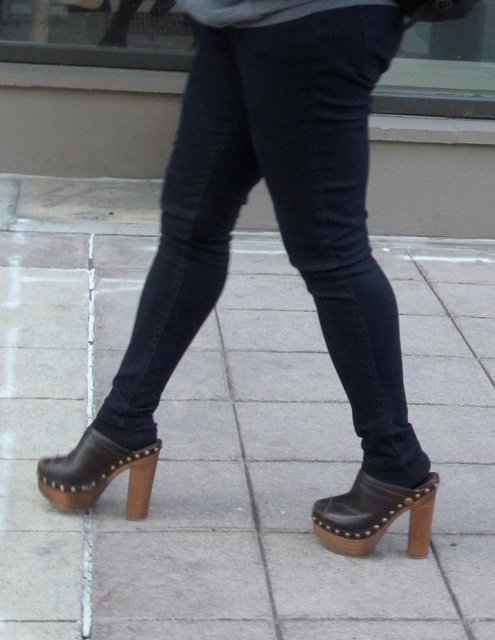
Is brown leather clogs at lower center taller than brown leather clog at lower right?

Indeed, brown leather clogs at lower center has a greater height compared to brown leather clog at lower right.

Does brown leather clogs at lower center appear on the right side of brown leather clog at lower right?

In fact, brown leather clogs at lower center is to the left of brown leather clog at lower right.

At what (x,y) coordinates should I click in order to perform the action: click on brown leather clogs at lower center. Please return your answer as a coordinate pair (x, y). Image resolution: width=495 pixels, height=640 pixels. Looking at the image, I should click on (232, 438).

Who is higher up, dark blue denim jeans at center or brown leather clog at lower right?

dark blue denim jeans at center

Who is lower down, dark blue denim jeans at center or brown leather clog at lower right?

brown leather clog at lower right

In order to click on dark blue denim jeans at center in this screenshot , I will do `click(278, 216)`.

Does point (375, 544) come in front of point (150, 484)?

Yes, point (375, 544) is closer to viewer.

Can you confirm if brown leather clog at lower right is smaller than brown leather clog at lower left?

No, brown leather clog at lower right is not smaller than brown leather clog at lower left.

Between point (351, 538) and point (139, 465), which one is positioned behind?

Point (139, 465)

Find the location of `brown leather clog at lower right`. brown leather clog at lower right is located at coordinates (375, 515).